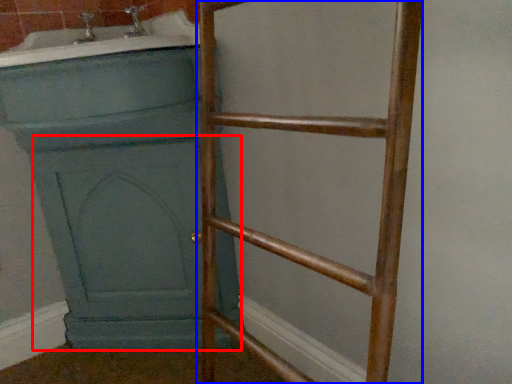
Question: Which object appears closest to the camera in this image, screen door (highlighted by a red box) or ladder (highlighted by a blue box)?

Choices:
 (A) screen door
 (B) ladder

Answer: (B)